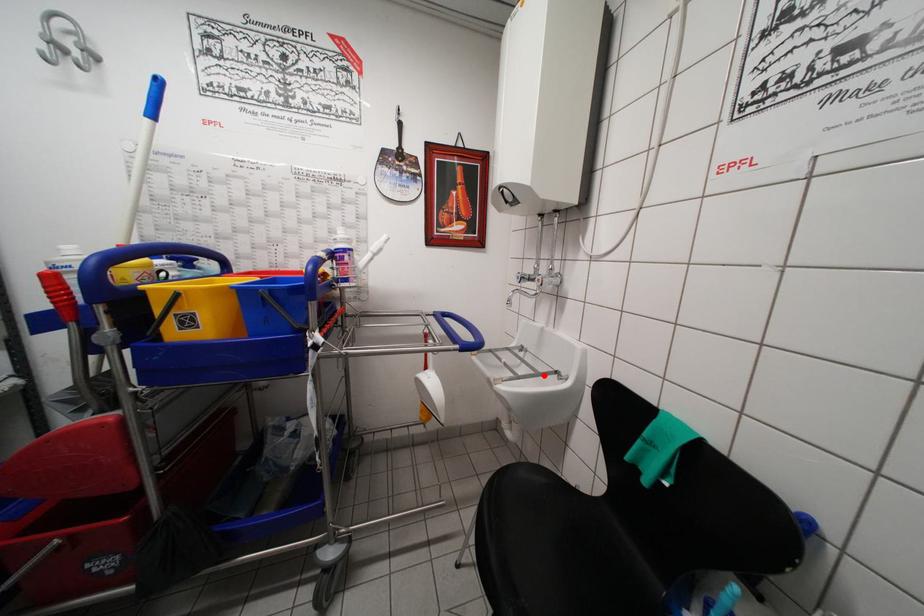
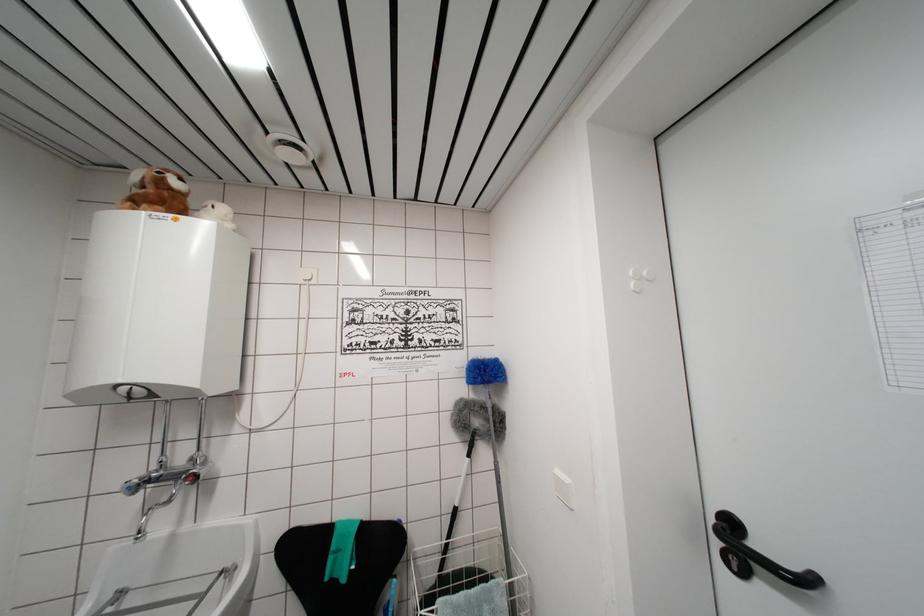
Question: I am providing you with two images of the same scene from different viewpoints. A red point is shown in image1. For the corresponding object point in image2, is it positioned nearer or farther from the camera?

Choices:
 (A) Nearer
 (B) Farther

Answer: (B)